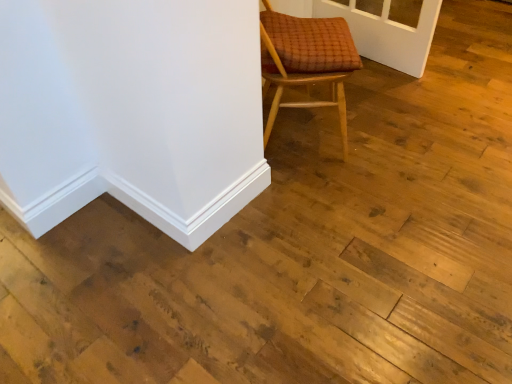
What do you see at coordinates (306, 61) in the screenshot? This screenshot has width=512, height=384. I see `brown woven cushioned chair at upper right` at bounding box center [306, 61].

Locate an element on the screen. brown woven cushioned chair at upper right is located at coordinates (306, 61).

The width and height of the screenshot is (512, 384). What are the coordinates of `brown woven cushioned chair at upper right` in the screenshot? It's located at (306, 61).